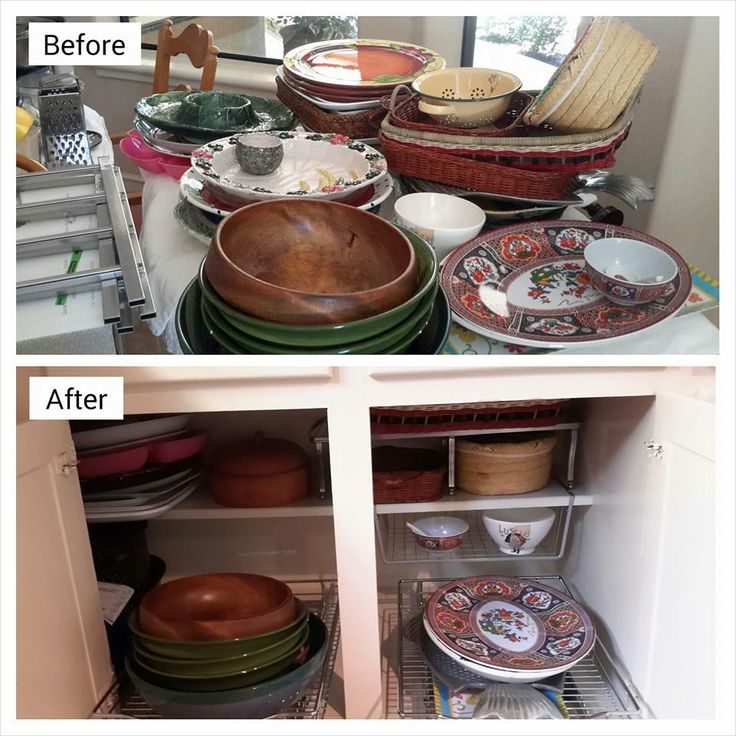
Locate an element on the screen. This screenshot has width=736, height=736. brown bowls is located at coordinates (235, 615), (263, 461), (332, 255).